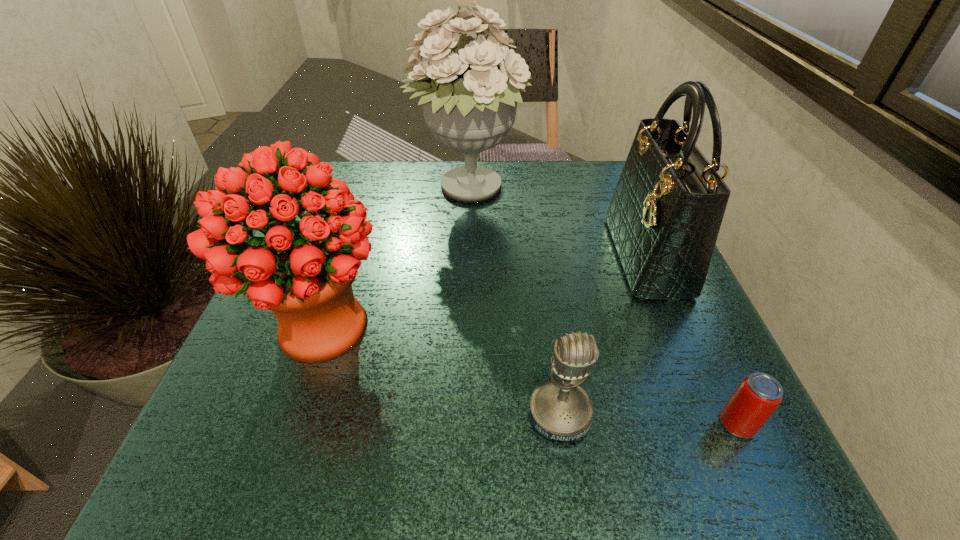
In the image, there is a desktop. Where is `vacant space at the near edge`? vacant space at the near edge is located at coordinates (315, 449).

In the image, there is a desktop. In order to click on vacant space at the left edge in this screenshot , I will do `click(308, 374)`.

Where is `free space at the right edge of the desktop`? Image resolution: width=960 pixels, height=540 pixels. free space at the right edge of the desktop is located at coordinates (624, 297).

You are a GUI agent. You are given a task and a screenshot of the screen. Output one action in this format:
    pyautogui.click(x=<x>, y=<y>)
    Task: Click on the vacant position at the far left corner of the desktop
    The height and width of the screenshot is (540, 960).
    Given the screenshot: What is the action you would take?
    pyautogui.click(x=348, y=184)

Find the location of `vacant space at the near left corner of the desktop`. vacant space at the near left corner of the desktop is located at coordinates (277, 476).

In the image, there is a desktop. Where is `vacant space at the far right corner`? The image size is (960, 540). vacant space at the far right corner is located at coordinates (585, 159).

In the image, there is a desktop. In order to click on free space at the near right corner in this screenshot , I will do `click(790, 481)`.

Where is `vacant area that lies between the handbag and the shortest object`? This screenshot has width=960, height=540. vacant area that lies between the handbag and the shortest object is located at coordinates (692, 340).

Locate an element on the screen. This screenshot has width=960, height=540. empty space that is in between the microphone and the handbag is located at coordinates (603, 335).

Identify the location of free space between the tallest object and the handbag. The width and height of the screenshot is (960, 540). (558, 224).